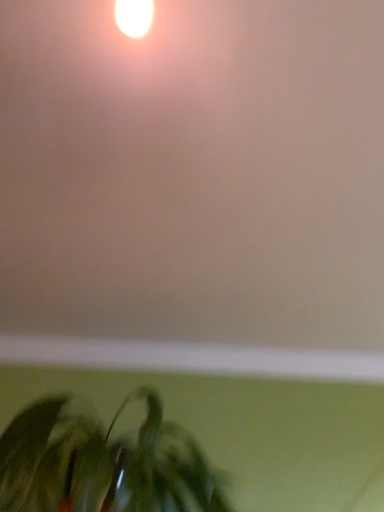
Question: Can you confirm if matte white wall at upper center is smaller than green matte plant at lower left?

Choices:
 (A) no
 (B) yes

Answer: (B)

Question: Considering the relative sizes of matte white wall at upper center and green matte plant at lower left in the image provided, is matte white wall at upper center thinner than green matte plant at lower left?

Choices:
 (A) yes
 (B) no

Answer: (B)

Question: From a real-world perspective, is matte white wall at upper center physically above green matte plant at lower left?

Choices:
 (A) yes
 (B) no

Answer: (A)

Question: Is matte white wall at upper center to the left of green matte plant at lower left from the viewer's perspective?

Choices:
 (A) yes
 (B) no

Answer: (B)

Question: Is the depth of matte white wall at upper center less than that of green matte plant at lower left?

Choices:
 (A) no
 (B) yes

Answer: (B)

Question: Is green matte plant at lower left at the back of matte white wall at upper center?

Choices:
 (A) no
 (B) yes

Answer: (A)

Question: From a real-world perspective, does green matte plant at lower left stand above matte white wall at upper center?

Choices:
 (A) yes
 (B) no

Answer: (B)

Question: Can you confirm if green matte plant at lower left is shorter than matte white wall at upper center?

Choices:
 (A) no
 (B) yes

Answer: (A)

Question: From the image's perspective, would you say green matte plant at lower left is shown under matte white wall at upper center?

Choices:
 (A) no
 (B) yes

Answer: (B)

Question: Considering the relative sizes of green matte plant at lower left and matte white wall at upper center in the image provided, is green matte plant at lower left wider than matte white wall at upper center?

Choices:
 (A) yes
 (B) no

Answer: (B)

Question: Is matte white wall at upper center completely or partially inside green matte plant at lower left?

Choices:
 (A) no
 (B) yes

Answer: (A)

Question: Could you tell me if green matte plant at lower left is turned towards matte white wall at upper center?

Choices:
 (A) no
 (B) yes

Answer: (A)

Question: Is green matte plant at lower left in front of or behind matte white wall at upper center in the image?

Choices:
 (A) behind
 (B) front

Answer: (A)